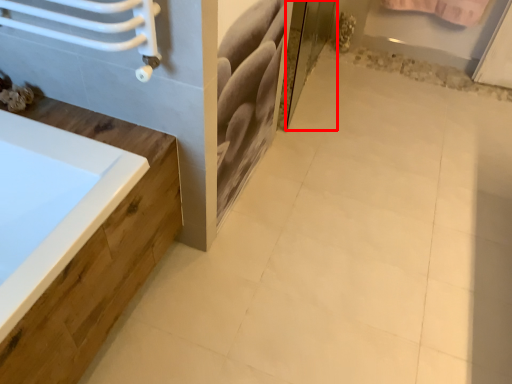
Question: From the image's perspective, what is the correct spatial positioning of screen door (annotated by the red box) in reference to ceramic tile?

Choices:
 (A) above
 (B) below

Answer: (A)